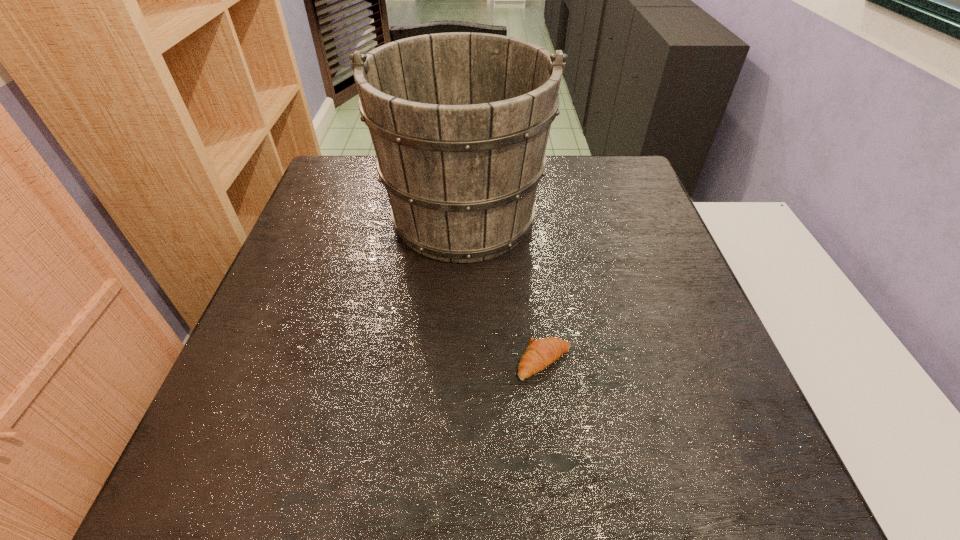
Identify the location of the taller object. Image resolution: width=960 pixels, height=540 pixels. (459, 121).

At what (x,y) coordinates should I click in order to perform the action: click on bucket. Please return your answer as a coordinate pair (x, y). Image resolution: width=960 pixels, height=540 pixels. Looking at the image, I should click on (459, 121).

Find the location of a particular element. Image resolution: width=960 pixels, height=540 pixels. the shorter object is located at coordinates (540, 353).

Image resolution: width=960 pixels, height=540 pixels. In order to click on the nearer object in this screenshot , I will do `click(540, 353)`.

What are the coordinates of `vacant space located on the left of the crescent roll` in the screenshot? It's located at (354, 362).

Locate an element on the screen. object at the far edge is located at coordinates (459, 121).

The width and height of the screenshot is (960, 540). Identify the location of free space at the far edge. (575, 173).

Locate an element on the screen. The height and width of the screenshot is (540, 960). vacant region at the left edge of the desktop is located at coordinates (317, 220).

This screenshot has height=540, width=960. In order to click on free space at the right edge in this screenshot , I will do `click(655, 259)`.

Locate an element on the screen. The image size is (960, 540). blank area at the far left corner is located at coordinates (336, 181).